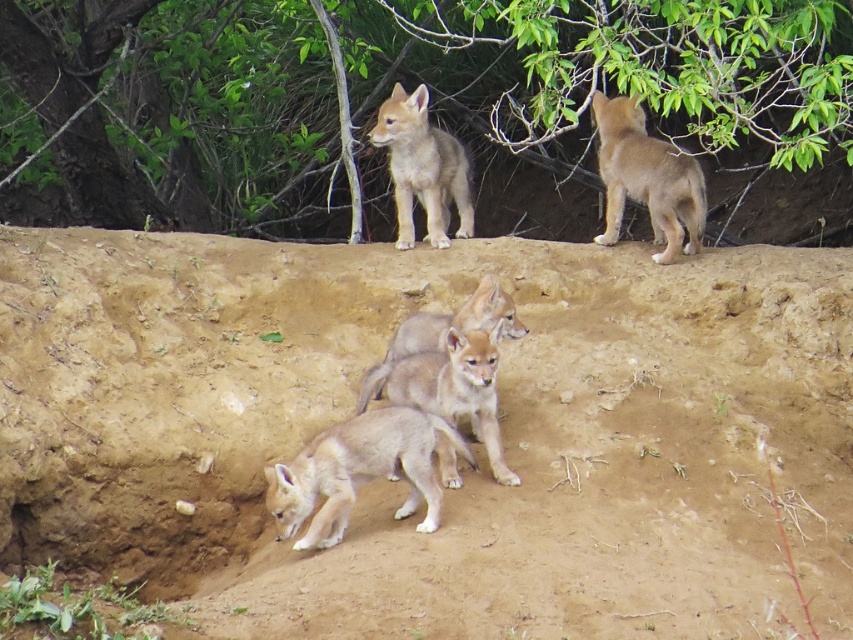
Question: Is fuzzy brown coyote at upper right positioned in front of fuzzy brown coyote at center?

Choices:
 (A) yes
 (B) no

Answer: (B)

Question: Is fuzzy tan pup at center positioned behind fuzzy brown coyote at center?

Choices:
 (A) no
 (B) yes

Answer: (A)

Question: Among these objects, which one is farthest from the camera?

Choices:
 (A) fuzzy beige pup at lower center
 (B) fuzzy brown coyote at upper center

Answer: (B)

Question: Which point is farther to the camera?

Choices:
 (A) brown sandy soil at center
 (B) fuzzy brown coyote at center

Answer: (B)

Question: Which point appears farthest from the camera in this image?

Choices:
 (A) (674, 228)
 (B) (395, 356)

Answer: (A)

Question: Does fuzzy brown coyote at upper right have a smaller size compared to fuzzy brown coyote at upper center?

Choices:
 (A) yes
 (B) no

Answer: (B)